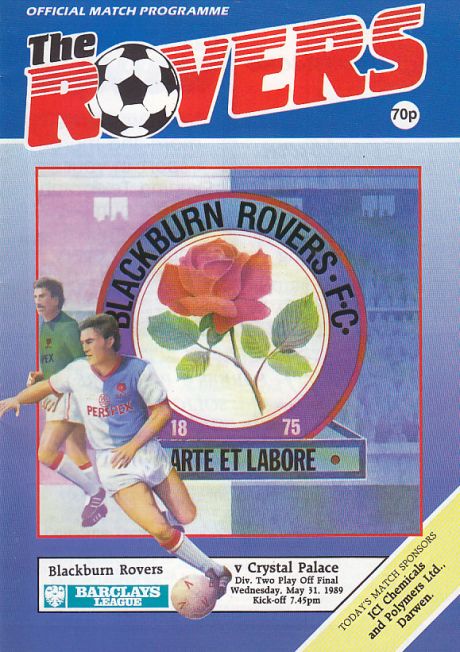
You are a GUI agent. You are given a task and a screenshot of the screen. Output one action in this format:
    pyautogui.click(x=<x>, y=<y>)
    Task: Click on the 3 socks
    The height and width of the screenshot is (652, 460).
    Given the screenshot: What is the action you would take?
    pyautogui.click(x=185, y=561), pyautogui.click(x=71, y=471), pyautogui.click(x=90, y=475)